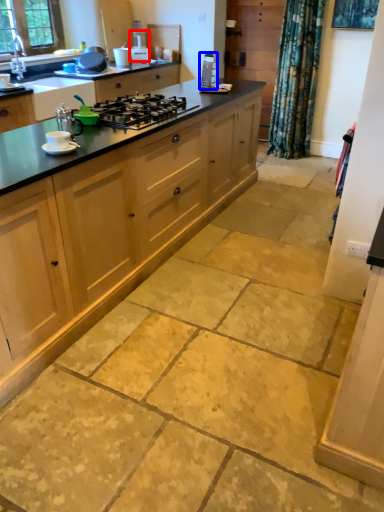
Question: Among these objects, which one is nearest to the camera, kitchen appliance (highlighted by a red box) or appliance (highlighted by a blue box)?

Choices:
 (A) kitchen appliance
 (B) appliance

Answer: (B)